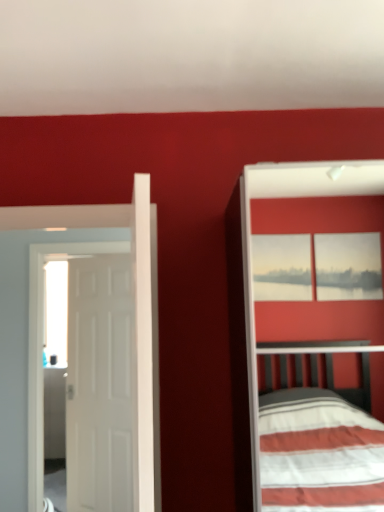
Question: Considering the positions of white matte door at left, acting as the first door starting from the back, and white matte door at left, the 2th door positioned from the back, in the image, is white matte door at left, acting as the first door starting from the back, bigger or smaller than white matte door at left, the 2th door positioned from the back,?

Choices:
 (A) small
 (B) big

Answer: (A)

Question: Considering the relative positions of white matte door at left, which is counted as the second door, starting from the front, and white matte door at left, which is counted as the 1th door, starting from the front, in the image provided, is white matte door at left, which is counted as the second door, starting from the front, to the left or to the right of white matte door at left, which is counted as the 1th door, starting from the front,?

Choices:
 (A) left
 (B) right

Answer: (A)

Question: From the image's perspective, is white matte door at left, acting as the first door starting from the back, positioned above or below white matte door at left, the 2th door positioned from the back?

Choices:
 (A) below
 (B) above

Answer: (A)

Question: Looking at their shapes, would you say white matte door at left, the 2th door positioned from the back, is wider or thinner than white matte door at left, acting as the first door starting from the back?

Choices:
 (A) wide
 (B) thin

Answer: (A)

Question: Considering the positions of white matte door at left, which is counted as the 1th door, starting from the front, and white matte door at left, acting as the first door starting from the back, in the image, is white matte door at left, which is counted as the 1th door, starting from the front, bigger or smaller than white matte door at left, acting as the first door starting from the back,?

Choices:
 (A) small
 (B) big

Answer: (B)

Question: Is white matte door at left, which is counted as the 1th door, starting from the front, inside or outside of white matte door at left, which is counted as the second door, starting from the front?

Choices:
 (A) outside
 (B) inside

Answer: (A)

Question: In terms of height, does white matte door at left, which is counted as the 1th door, starting from the front, look taller or shorter compared to white matte door at left, acting as the first door starting from the back?

Choices:
 (A) tall
 (B) short

Answer: (B)